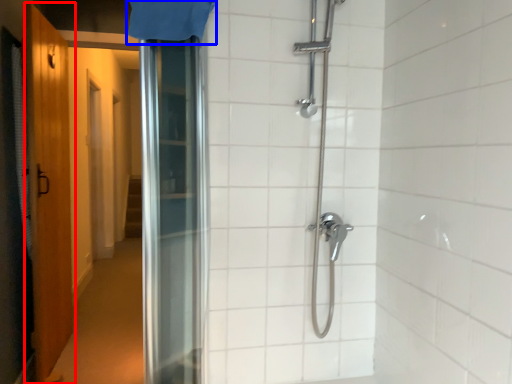
Question: Which object is further to the camera taking this photo, door (highlighted by a red box) or shower curtain (highlighted by a blue box)?

Choices:
 (A) door
 (B) shower curtain

Answer: (A)